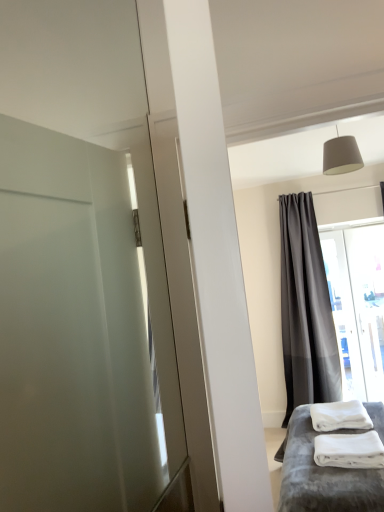
Image resolution: width=384 pixels, height=512 pixels. What are the coordinates of `vacant area situated to the left side of white soft towels at lower right` in the screenshot? It's located at (298, 467).